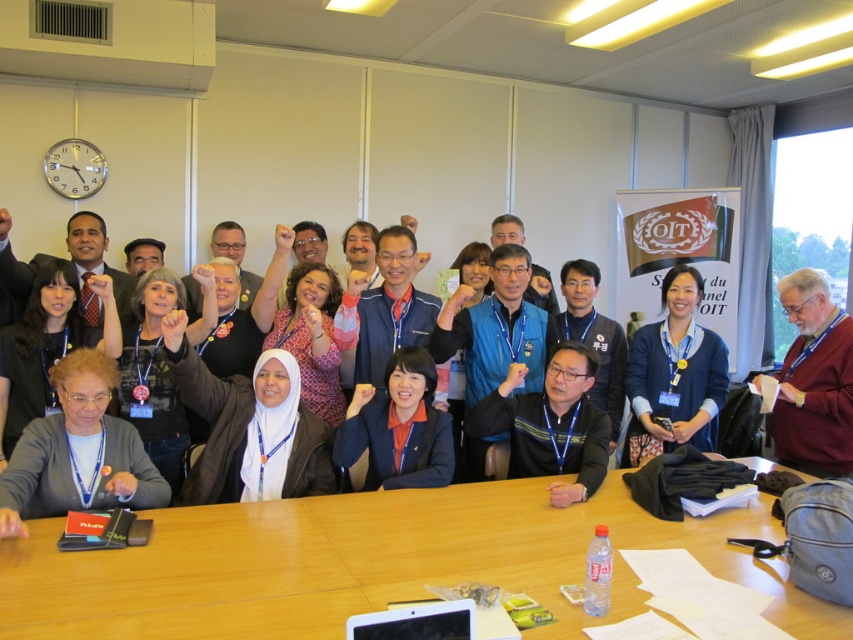
Is blue sweater at center wider than maroon sweater at right?

Correct, the width of blue sweater at center exceeds that of maroon sweater at right.

What do you see at coordinates (674, 374) in the screenshot? The width and height of the screenshot is (853, 640). I see `blue sweater at center` at bounding box center [674, 374].

What are the coordinates of `blue sweater at center` in the screenshot? It's located at (674, 374).

Who is taller, wooden table at center or blue sweater at center?

blue sweater at center is taller.

Can you confirm if wooden table at center is taller than blue sweater at center?

No.

Where is `wooden table at center`? Image resolution: width=853 pixels, height=640 pixels. wooden table at center is located at coordinates (370, 563).

From the picture: Between blue sweater at center and blue fabric jacket at center, which one is positioned lower?

blue fabric jacket at center is lower down.

Can you confirm if blue sweater at center is smaller than blue fabric jacket at center?

No.

Is point (706, 376) positioned after point (444, 412)?

Yes, it is.

Locate an element on the screen. blue sweater at center is located at coordinates [674, 374].